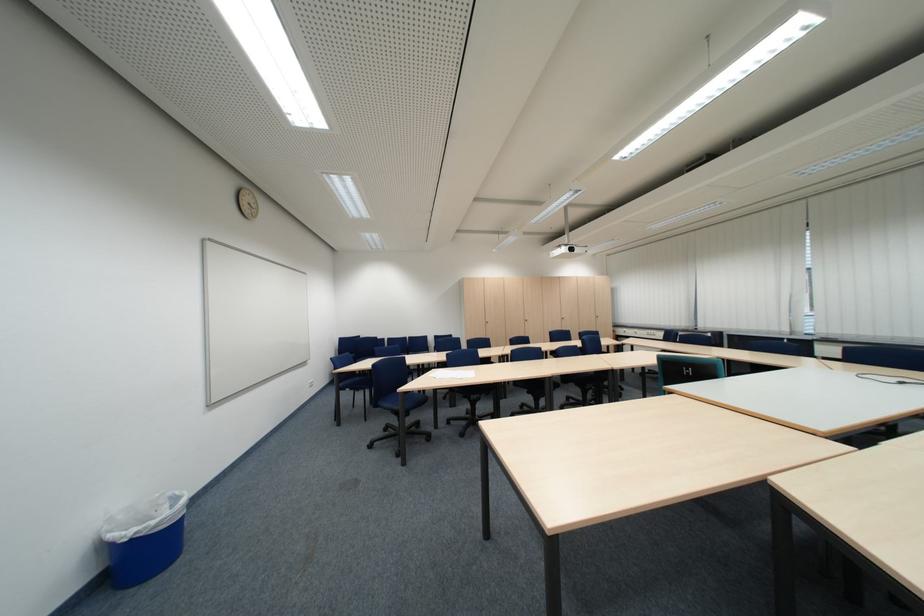
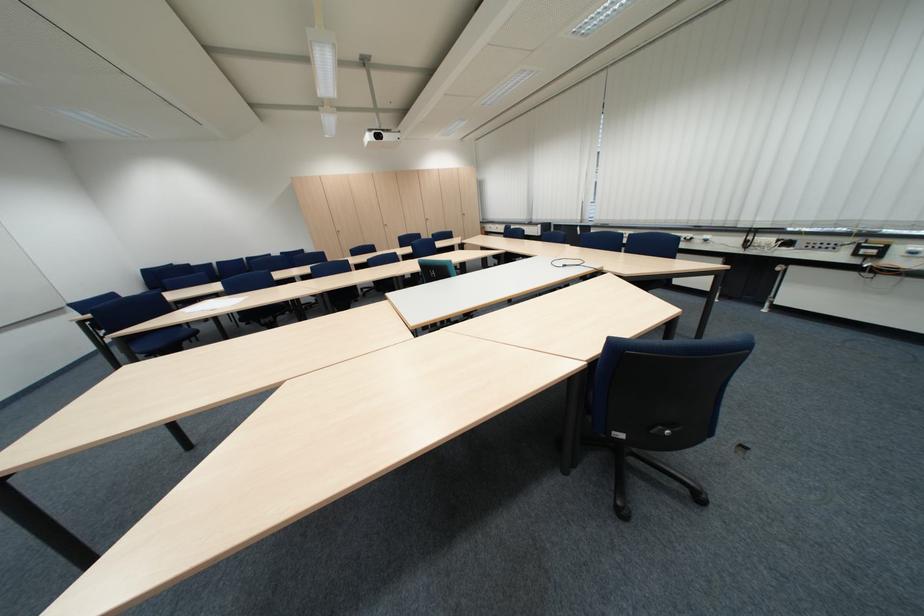
Question: In a continuous first-person perspective shot, in which direction is the camera moving?

Choices:
 (A) Left
 (B) Right
 (C) Forward
 (D) Backward

Answer: (B)